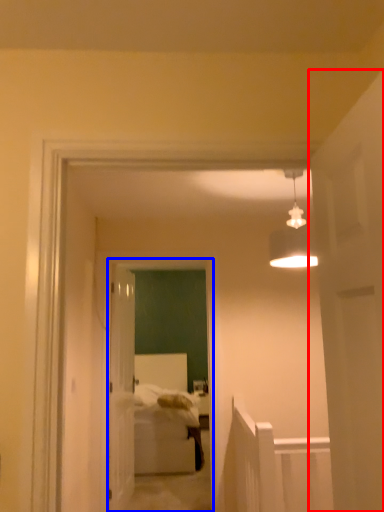
Question: Which object is further to the camera taking this photo, door (highlighted by a red box) or glass door (highlighted by a blue box)?

Choices:
 (A) door
 (B) glass door

Answer: (B)